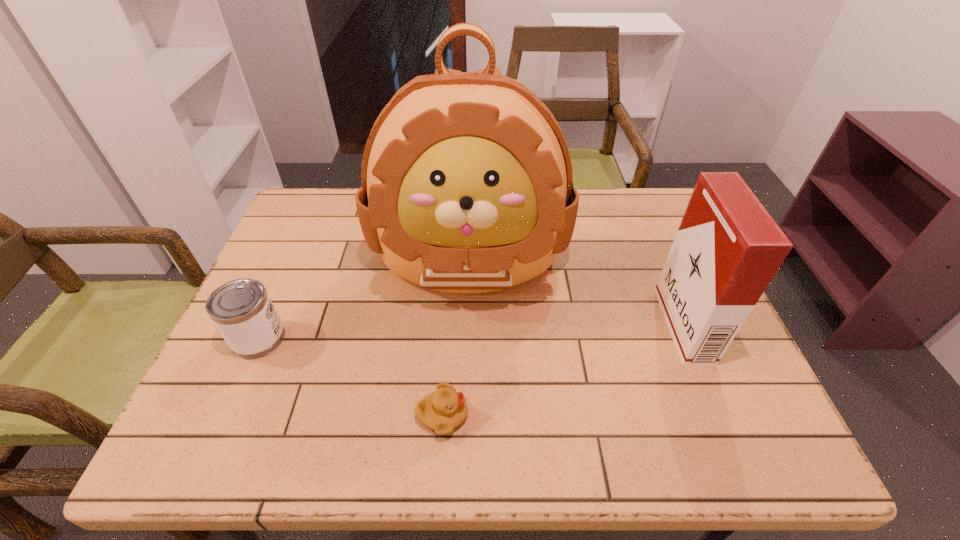
The image size is (960, 540). I want to click on empty space between the rightmost object and the duckling, so click(563, 370).

Locate an element on the screen. The height and width of the screenshot is (540, 960). object that can be found as the second closest to the leftmost object is located at coordinates (442, 411).

Choose which object is the nearest neighbor to the backpack. Please provide its 2D coordinates. Your answer should be formatted as a tuple, i.e. [(x, y)], where the tuple contains the x and y coordinates of a point satisfying the conditions above.

[(242, 311)]

Identify the location of free space that satisfies the following two spatial constraints: 1. on the front-facing side of the tallest object; 2. at the beak of the duckling. The image size is (960, 540). (465, 416).